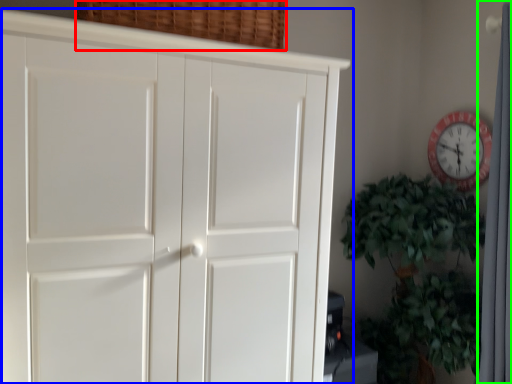
Question: Which object is the closest to the basket (highlighted by a red box)? Choose among these: cupboard (highlighted by a blue box) or curtain (highlighted by a green box).

Choices:
 (A) cupboard
 (B) curtain

Answer: (A)